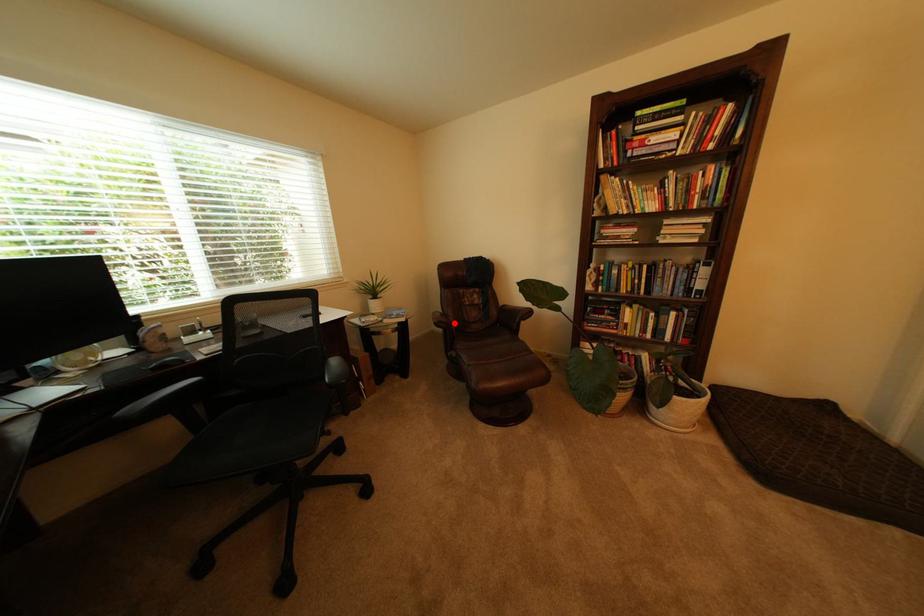
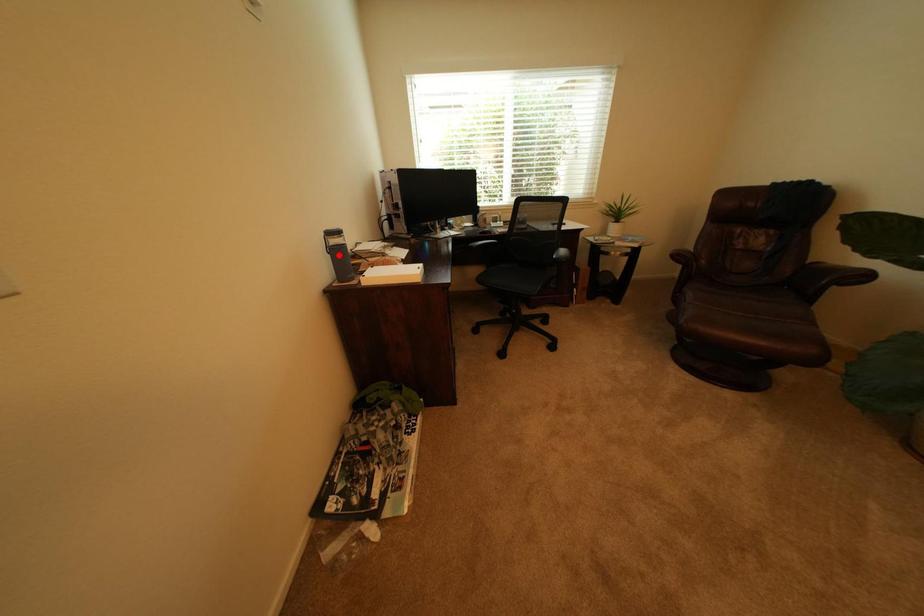
I am providing you with two images of the same scene from different viewpoints. A red point is marked on the first image and another point is marked on the second image. Are the points marked in image1 and image2 representing the same 3D position?

No